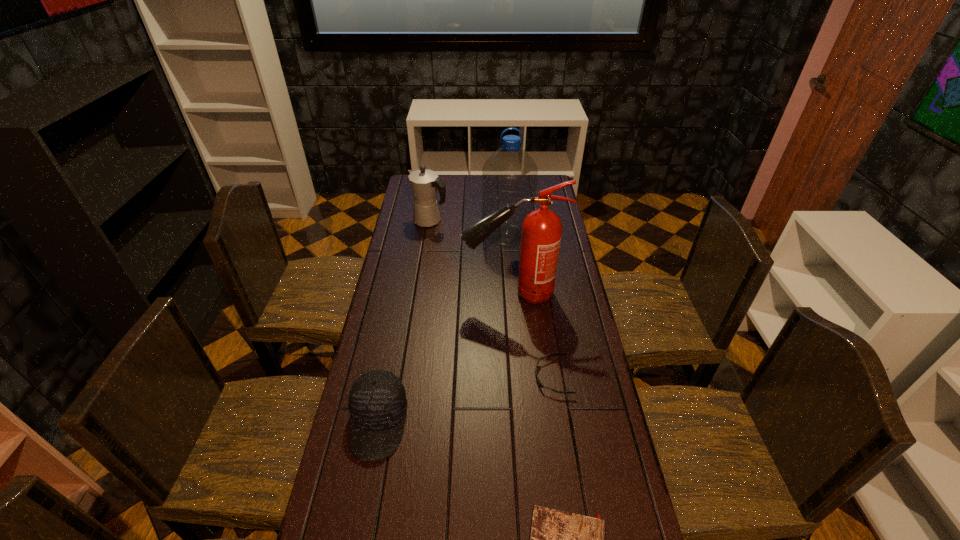
You are a GUI agent. You are given a task and a screenshot of the screen. Output one action in this format:
    pyautogui.click(x=<x>, y=<y>)
    Task: Click on the free spot located 0.060m at the front of the baseball cap where the brim is located
    This screenshot has height=540, width=960.
    Given the screenshot: What is the action you would take?
    pyautogui.click(x=367, y=486)

Where is `blank space located 0.330m on the front-facing side of the sunglasses`? The image size is (960, 540). blank space located 0.330m on the front-facing side of the sunglasses is located at coordinates (432, 376).

Locate an element on the screen. Image resolution: width=960 pixels, height=540 pixels. free space located on the front-facing side of the sunglasses is located at coordinates (457, 376).

I want to click on free space located 0.360m on the front-facing side of the sunglasses, so click(x=422, y=376).

Identify the location of coffeepot that is at the left edge. This screenshot has height=540, width=960. point(424,182).

The width and height of the screenshot is (960, 540). In order to click on baseball cap positioned at the left edge in this screenshot , I will do `click(377, 401)`.

The height and width of the screenshot is (540, 960). What are the coordinates of `water jug positioned at the right edge` in the screenshot? It's located at (509, 175).

Locate an element on the screen. The image size is (960, 540). fire extinguisher that is at the right edge is located at coordinates (541, 233).

Find the location of a particular element. sunglasses that is positioned at the right edge is located at coordinates (538, 381).

Locate an element on the screen. The image size is (960, 540). free space at the far edge of the desktop is located at coordinates (452, 174).